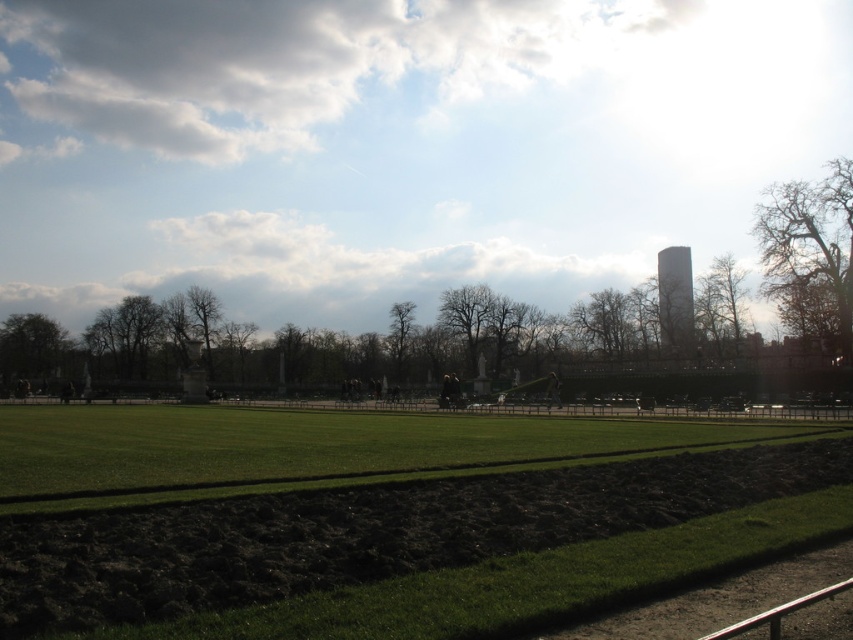
You are a drone operator who needs to capture aerial footage of the park. The drone has a maximum flight altitude of 50 meters. Given the scene described, will the drone be able to reach the bright white sky at upper center without exceeding its altitude limit?

The distance between the bright white sky at upper center and the camera is 75.26 meters. Since the drone can only fly up to 50 meters, it will not be able to reach the bright white sky at upper center without exceeding its altitude limit.

You are standing at the camera position in the park scene. There is a point marked at coordinates point (299,120). Can you estimate how far you are from that point?

The distance between the camera and the point (299,120) is 195.72 meters.

You are standing in the park and want to walk from the metal railing in the bottom right corner to the row of white statues beyond the trees. You notice two points marked on your map at coordinates point (422, 92) and point (740, 625). Which point is closer to your starting position near the metal railing?

Point (422, 92) is closer to your starting position near the metal railing because it is further to the viewer than point (740, 625).